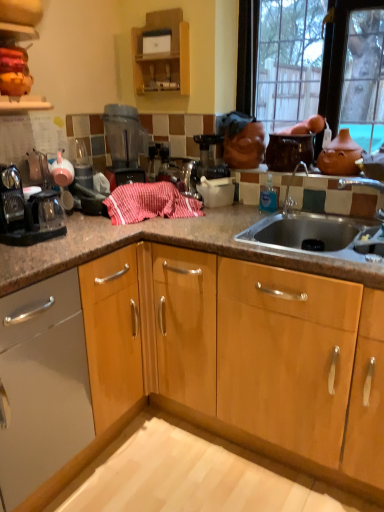
Question: Can you confirm if wooden cabinet at upper center is taller than terracotta clay teapot at upper right?

Choices:
 (A) yes
 (B) no

Answer: (A)

Question: From the image's perspective, does wooden cabinet at upper center appear higher than terracotta clay teapot at upper right?

Choices:
 (A) yes
 (B) no

Answer: (A)

Question: Is the surface of wooden cabinet at upper center in direct contact with terracotta clay teapot at upper right?

Choices:
 (A) yes
 (B) no

Answer: (B)

Question: Can you confirm if wooden cabinet at upper center is shorter than terracotta clay teapot at upper right?

Choices:
 (A) no
 (B) yes

Answer: (A)

Question: Is wooden cabinet at upper center facing away from terracotta clay teapot at upper right?

Choices:
 (A) yes
 (B) no

Answer: (B)

Question: Is wooden cabinet at upper center bigger than terracotta clay teapot at upper right?

Choices:
 (A) yes
 (B) no

Answer: (A)

Question: From the image's perspective, is transparent plastic blender at upper center on top of wooden cabinet at upper center?

Choices:
 (A) no
 (B) yes

Answer: (A)

Question: Does transparent plastic blender at upper center come in front of wooden cabinet at upper center?

Choices:
 (A) no
 (B) yes

Answer: (B)

Question: Is transparent plastic blender at upper center taller than wooden cabinet at upper center?

Choices:
 (A) no
 (B) yes

Answer: (B)

Question: Can you confirm if transparent plastic blender at upper center is thinner than wooden cabinet at upper center?

Choices:
 (A) yes
 (B) no

Answer: (B)

Question: Is transparent plastic blender at upper center not inside wooden cabinet at upper center?

Choices:
 (A) yes
 (B) no

Answer: (A)

Question: Considering the relative positions of transparent plastic blender at upper center and wooden cabinet at upper center in the image provided, is transparent plastic blender at upper center behind wooden cabinet at upper center?

Choices:
 (A) no
 (B) yes

Answer: (A)

Question: From a real-world perspective, is matte black coffee maker at left on terracotta clay teapot at upper right?

Choices:
 (A) no
 (B) yes

Answer: (A)